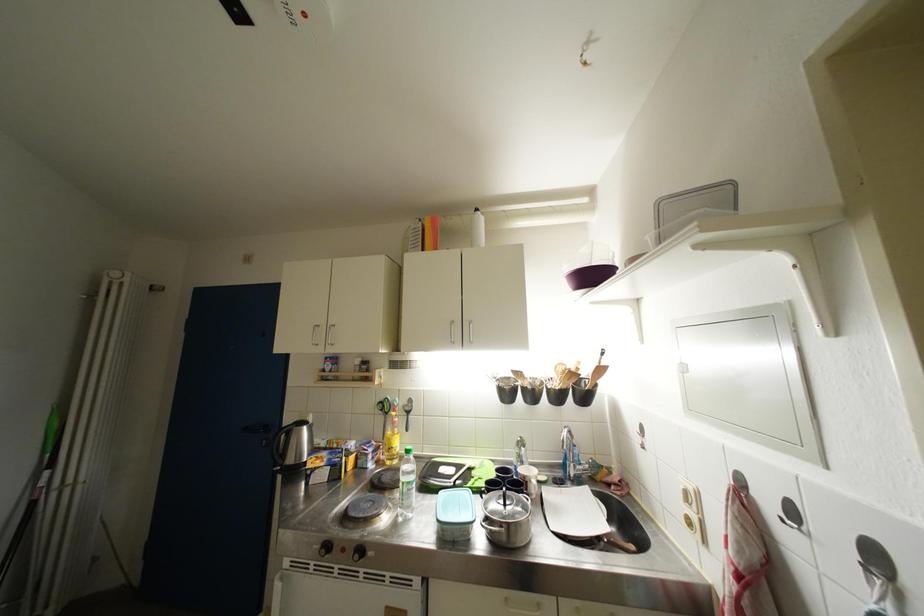
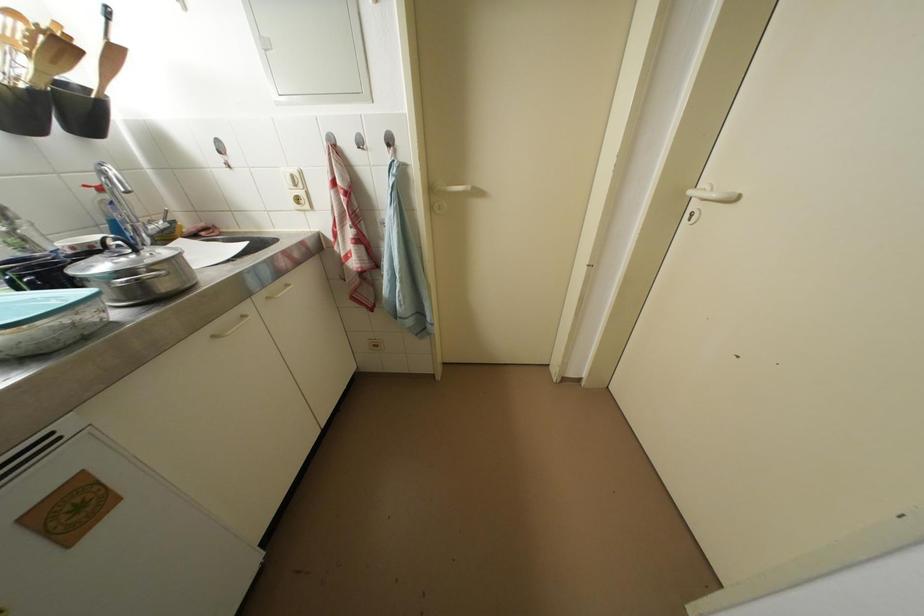
The images are taken continuously from a first-person perspective. In which direction is your viewpoint rotating?

The camera's rotation is toward right-down.